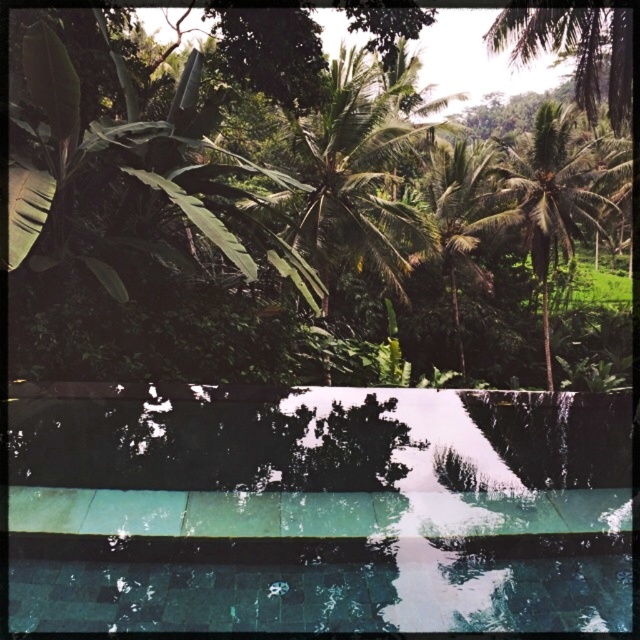
You are planning to install a new fence around the green tile swimming pool at center and the green leafy tree at upper center. The fence must be wide enough to accommodate both. Which object requires a wider fence to enclose it?

The green leafy tree at upper center requires a wider fence because the green tile swimming pool at center has a smaller width than the green leafy tree at upper center.

Consider the image. You are standing at the edge of the rectangular swimming pool with clear blue water, bordered by dark tiles at the edge. You want to place a large potted plant in the pool area so it doesn not block the view of the green leafy tree at upper center and green leafy palm tree at upper right. Which tree should you avoid blocking the view of?

You should avoid blocking the view of the green leafy tree at upper center because it is larger in size than the green leafy palm tree at upper right, making it more prominent and likely the focal point.

You are a guest staying at the villa and want to enjoy the view of the green leafy tree at upper center while relaxing in the green tile swimming pool at center. Can you see the tree from the pool?

The green tile swimming pool at center is below the green leafy tree at upper center, so yes, you can see the tree from the pool as it is positioned above the pool.